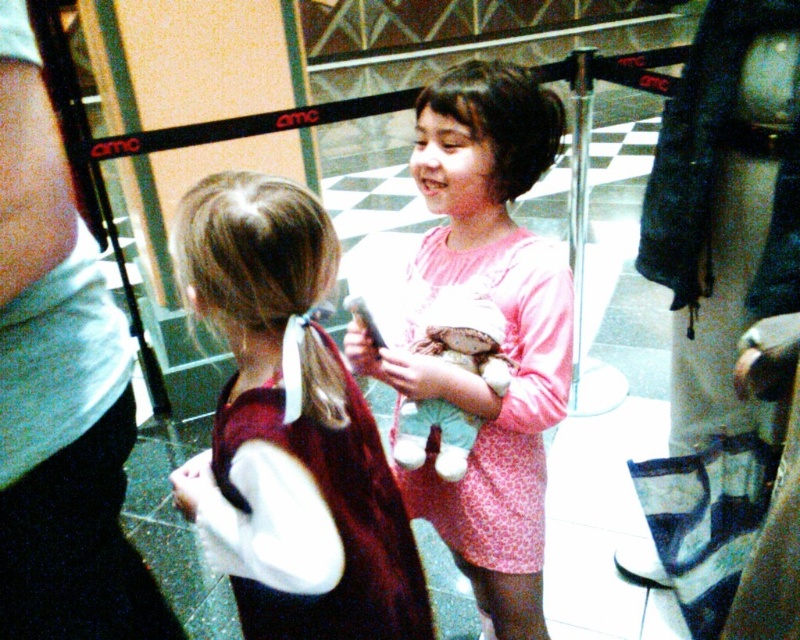
From the picture: You are a photographer trying to capture both the white cotton shirt at upper left and the pink fabric dress at center in a single shot. Based on their positions, which one should you focus on first to ensure both are in frame?

The white cotton shirt at upper left is located above the pink fabric dress at center, so you should focus on the pink fabric dress at center first to ensure both are in frame.

You are a photographer trying to capture a candid shot of the two girls without them noticing. You have a camera with a lens that has a 18 inch focal length. The minimum focusing distance of the lens is 20 inches. Can you take a clear photo of both the white cotton shirt at upper left and the fluffy plush toy at center at the same time?

The white cotton shirt at upper left and the fluffy plush toy at center are 19.11 inches apart from each other. Since the minimum focusing distance is 20 inches, the photographer needs to be at least 20 inches away to focus. However, the distance between the two objects is less than 20 inches, so if the photographer is exactly 20 inches away, both objects are within the focal range and can be captured clearly. Alternatively, if the photographer moves further back, the entire scene would still be in focus as

You are a photographer trying to capture the two girls in the image. You notice that the pink fabric dress at center is at point (506, 332). Where should you position your camera to ensure both girls are in frame?

The pink fabric dress at center is located at point (506, 332), so positioning the camera centrally would ensure both girls are in frame.